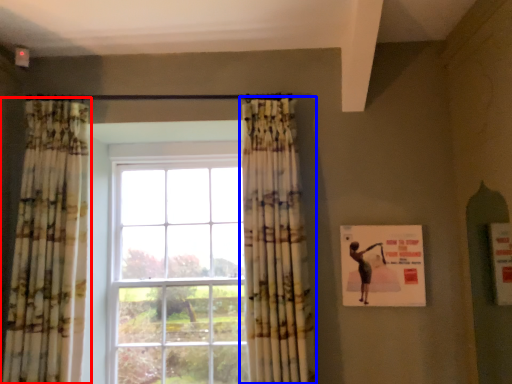
Question: Which object appears farthest to the camera in this image, curtain (highlighted by a red box) or curtain (highlighted by a blue box)?

Choices:
 (A) curtain
 (B) curtain

Answer: (A)